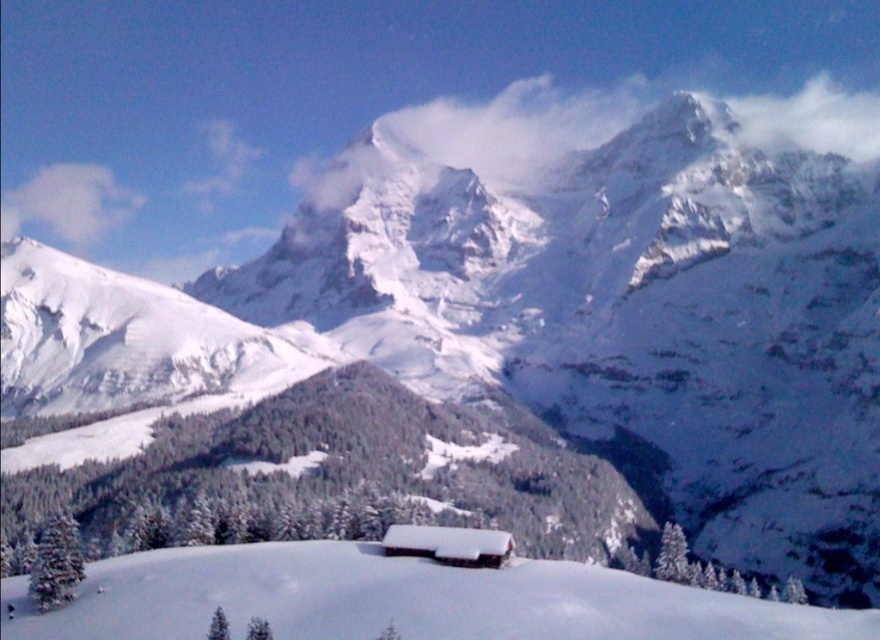
Is white snow ski slope at center closer to camera compared to white fluffy cloud at upper left?

Yes, white snow ski slope at center is closer to the viewer.

Is white snow ski slope at center shorter than white fluffy cloud at upper left?

Correct, white snow ski slope at center is not as tall as white fluffy cloud at upper left.

Locate an element on the screen. This screenshot has width=880, height=640. white snow ski slope at center is located at coordinates [401, 600].

At what (x,y) coordinates should I click in order to perform the action: click on white snow ski slope at center. Please return your answer as a coordinate pair (x, y). The height and width of the screenshot is (640, 880). Looking at the image, I should click on (401, 600).

Is the position of white snow ski slope at center more distant than that of white wooden cabin at center?

That is False.

Is white snow ski slope at center thinner than white wooden cabin at center?

In fact, white snow ski slope at center might be wider than white wooden cabin at center.

Image resolution: width=880 pixels, height=640 pixels. What do you see at coordinates (401, 600) in the screenshot?
I see `white snow ski slope at center` at bounding box center [401, 600].

I want to click on white snow ski slope at center, so click(401, 600).

Between white fluffy cloud at upper left and white wooden cabin at center, which one has more height?

white fluffy cloud at upper left

Is white fluffy cloud at upper left below white wooden cabin at center?

No, white fluffy cloud at upper left is not below white wooden cabin at center.

Is point (12, 211) positioned in front of point (475, 529)?

That is False.

Image resolution: width=880 pixels, height=640 pixels. In order to click on white fluffy cloud at upper left in this screenshot , I will do `click(68, 202)`.